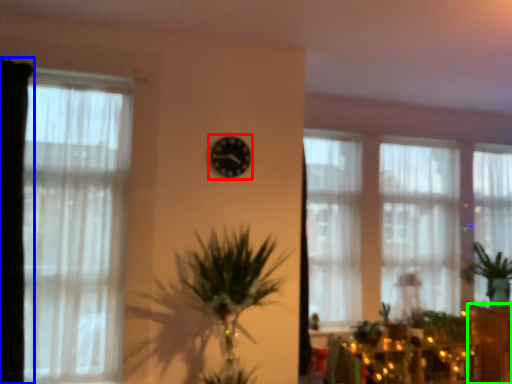
Question: Which object is positioned farthest from clock (highlighted by a red box)? Select from curtain (highlighted by a blue box) and furniture (highlighted by a green box).

Choices:
 (A) curtain
 (B) furniture

Answer: (B)